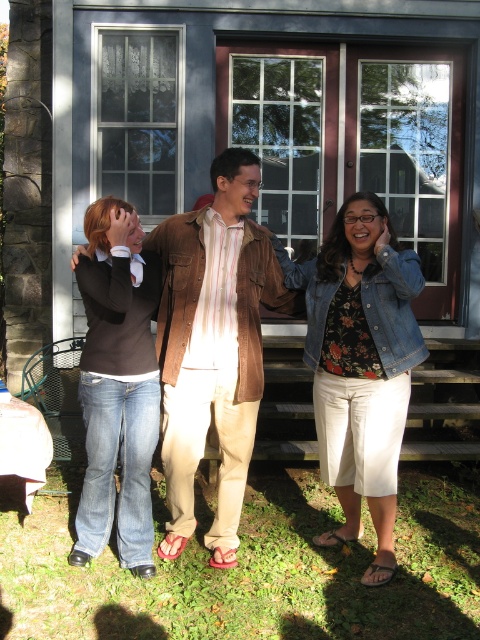
Question: Is brown corduroy shirt at center thinner than floral print blouse at center?

Choices:
 (A) yes
 (B) no

Answer: (B)

Question: Does floral print blouse at center appear under denim jeans at lower left?

Choices:
 (A) yes
 (B) no

Answer: (A)

Question: Which object appears closest to the camera in this image?

Choices:
 (A) denim jeans at lower left
 (B) brown corduroy shirt at center
 (C) floral print blouse at center

Answer: (C)

Question: Which point is closer to the camera?

Choices:
 (A) brown corduroy shirt at center
 (B) floral print blouse at center

Answer: (B)

Question: Among these objects, which one is farthest from the camera?

Choices:
 (A) denim jeans at lower left
 (B) brown corduroy shirt at center

Answer: (B)

Question: In this image, where is floral print blouse at center located relative to denim jeans at lower left?

Choices:
 (A) right
 (B) left

Answer: (A)